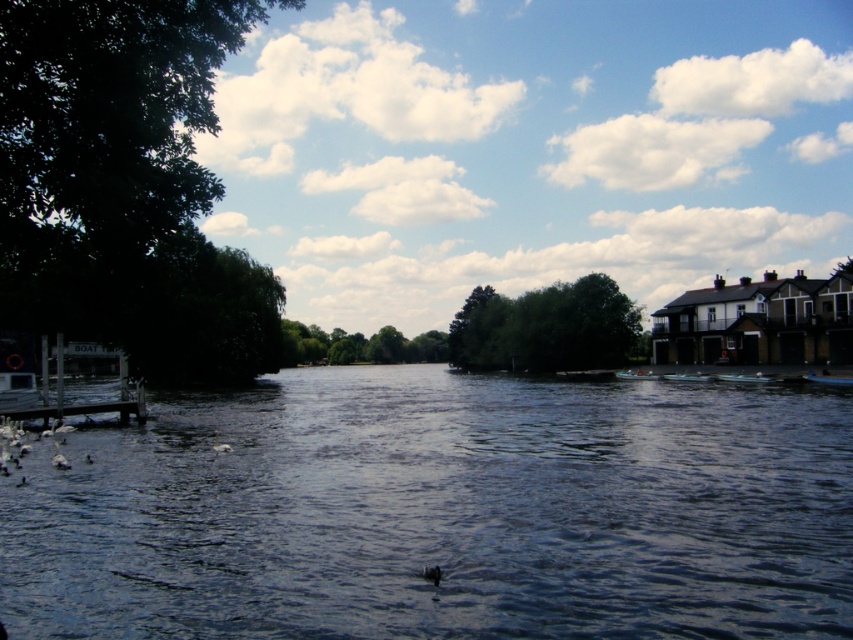
The width and height of the screenshot is (853, 640). Describe the element at coordinates (86, 406) in the screenshot. I see `wooden dock at left` at that location.

The image size is (853, 640). Identify the location of wooden dock at left. coord(86,406).

Where is `wooden dock at left`? The height and width of the screenshot is (640, 853). wooden dock at left is located at coordinates (86, 406).

Is point (218, 513) behind point (219, 449)?

No, (218, 513) is closer to viewer.

Between dark blue water at center and white feathered bird at center, which one is positioned lower?

dark blue water at center is lower down.

Does point (570, 442) come in front of point (219, 452)?

That is False.

Identify the location of dark blue water at center. The width and height of the screenshot is (853, 640). (440, 513).

Can you confirm if white plastic boat at center-right is thinner than white feathered bird at center?

Incorrect, white plastic boat at center-right's width is not less than white feathered bird at center's.

Does white plastic boat at center-right come in front of white feathered bird at center?

No.

Find the location of a particular element. white plastic boat at center-right is located at coordinates (688, 376).